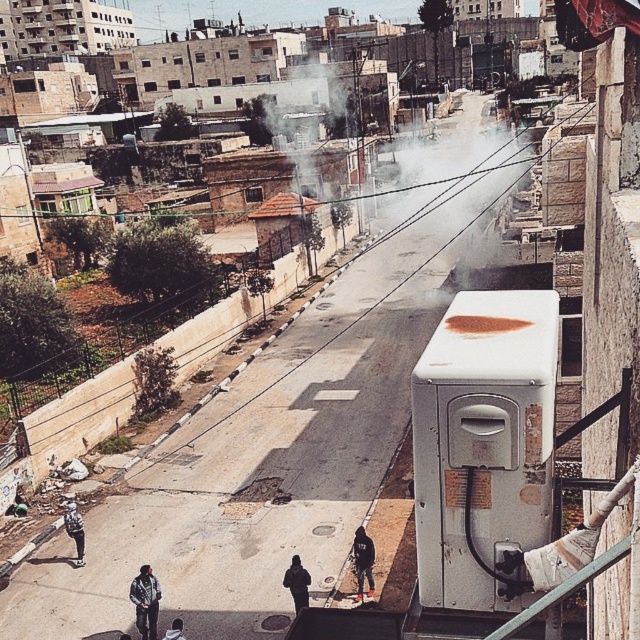
You are standing on the elevated position looking down at the street scene. You see a dark blue jeans at lower left and a dark gray hoodie at lower center. Which of these two items is positioned higher from the ground level?

The dark blue jeans at lower left is above the dark gray hoodie at lower center, so it is positioned higher from the ground level.

You are a delivery person who needs to place a package between the dark gray jacket at lower left and the dark gray hoodie at lower center. The package is 5 feet long. Will it fit between them?

The distance between the dark gray jacket at lower left and the dark gray hoodie at lower center is 5.12 feet, so the 5 feet long package will fit between them.